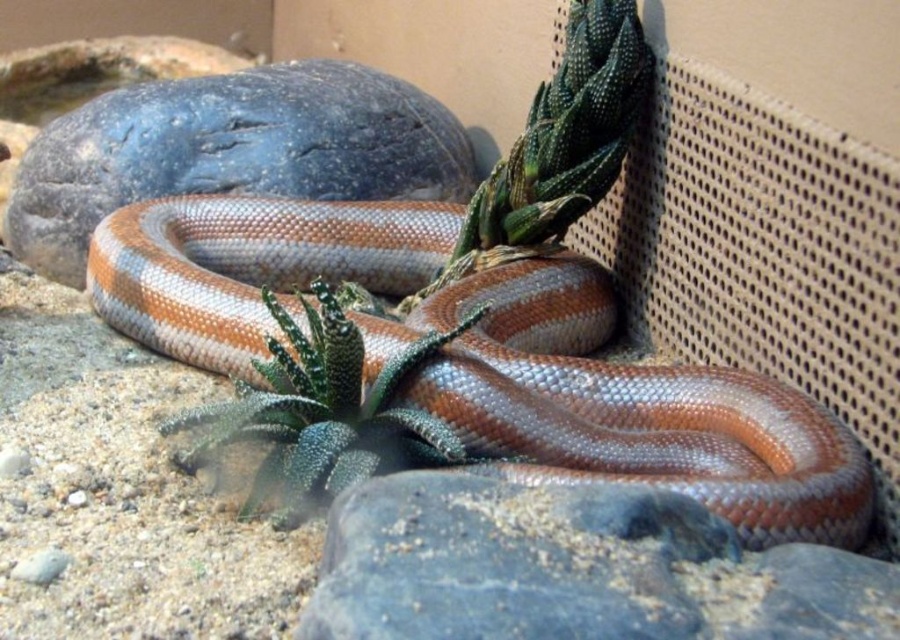
Question: Considering the real-world distances, which object is farthest from the green spiky cactus at center?

Choices:
 (A) shiny brown snake at center
 (B) smooth gray rock at lower center
 (C) smooth gray rock at upper left

Answer: (C)

Question: Is shiny brown snake at center further to the viewer compared to smooth gray rock at upper left?

Choices:
 (A) no
 (B) yes

Answer: (A)

Question: Which object appears farthest from the camera in this image?

Choices:
 (A) smooth gray rock at upper left
 (B) shiny brown snake at center
 (C) smooth gray rock at lower center
 (D) green spiky cactus at center

Answer: (A)

Question: Does shiny brown snake at center have a smaller size compared to green spiky cactus at center?

Choices:
 (A) yes
 (B) no

Answer: (B)

Question: Which point is closer to the camera taking this photo?

Choices:
 (A) (19, 221)
 (B) (603, 512)
 (C) (632, 472)

Answer: (B)

Question: Is shiny brown snake at center behind smooth gray rock at upper left?

Choices:
 (A) yes
 (B) no

Answer: (B)